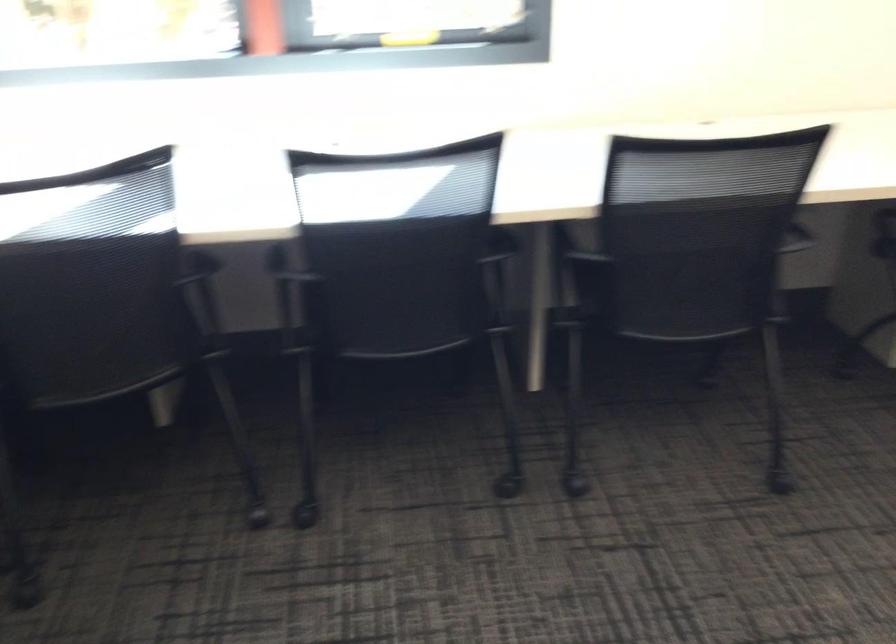
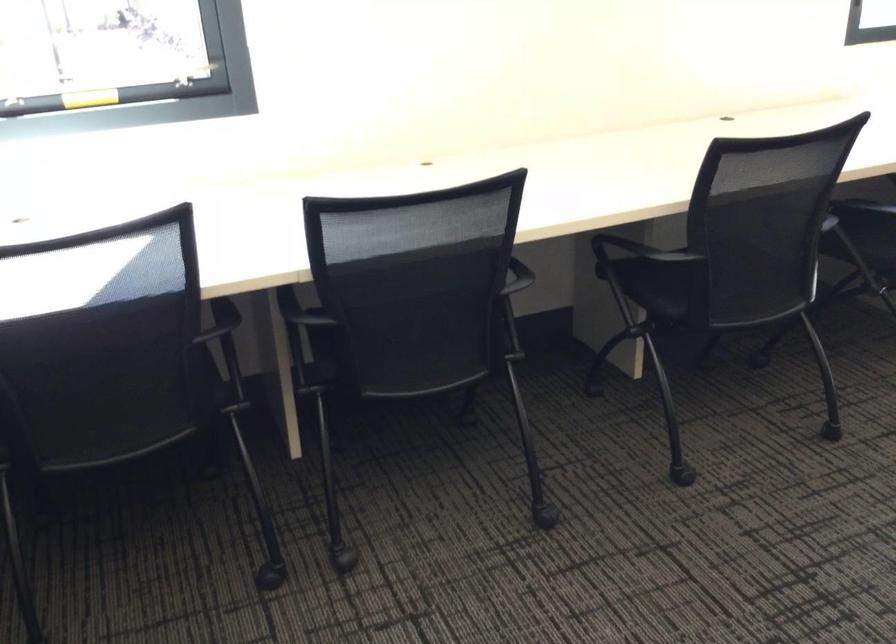
In a continuous first-person perspective shot, in which direction is the camera moving?

The cameraman walked toward right, forward.